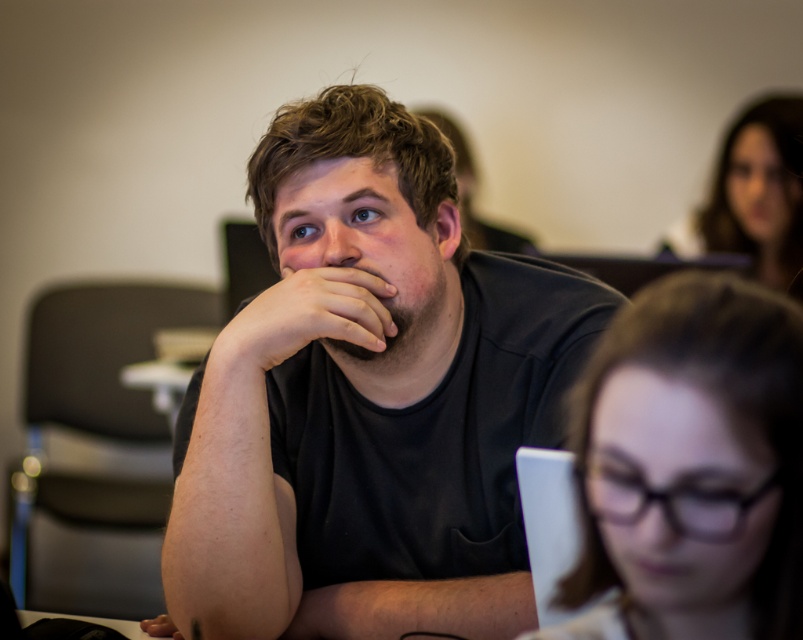
You are a photographer who just took a picture of a classroom scene. In the image, you see a black matte shirt at center and a smooth brown hair at upper right. Which object is positioned higher in the image?

The smooth brown hair at upper right is positioned higher than the black matte shirt at center in the image.

Looking at this image, you are a photographer adjusting the lighting in a classroom. You notice the black matte shirt at center and the matte black hand at center. To ensure both are well lit, how far apart are they?

The black matte shirt at center is 4.58 inches from the matte black hand at center, so adjusting the lighting to cover this distance should adequately illuminate both.

You are a photographer who wants to adjust the lighting in the classroom to ensure both the black matte shirt at center and the matte black hand at center are clearly visible. Since both objects are dark, what could be a reason the hand is more noticeable than the shirt?

The black matte hand at center is positioned above the black matte shirt at center, creating a visual contrast that makes the hand stand out more against the shirt.